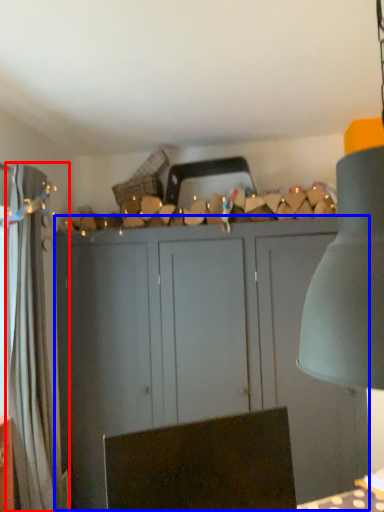
Question: Which point is closer to the camera, curtain (highlighted by a red box) or cupboard (highlighted by a blue box)?

Choices:
 (A) curtain
 (B) cupboard

Answer: (A)